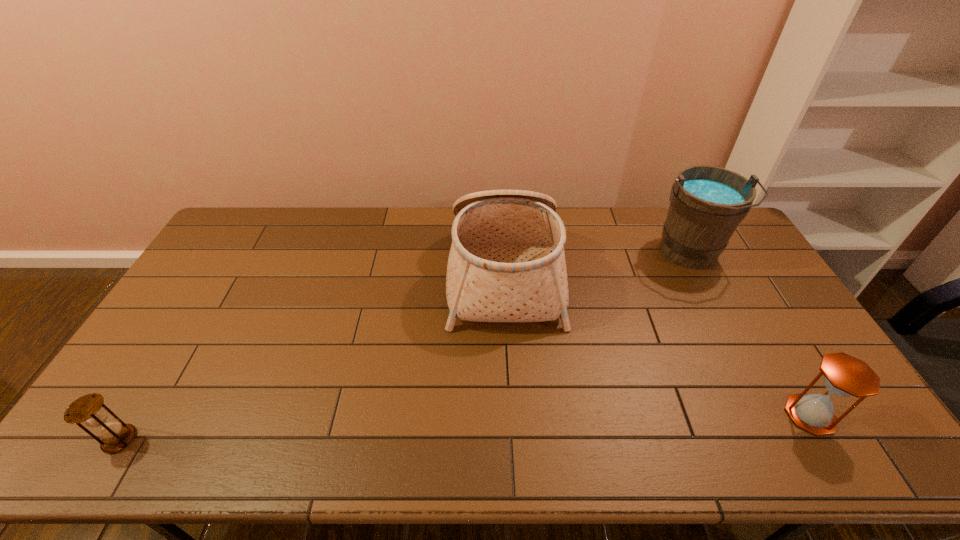
Where is `blank area located on the left of the right hourglass`? This screenshot has width=960, height=540. blank area located on the left of the right hourglass is located at coordinates (692, 415).

Where is `vacant point located on the right of the shortest object`? This screenshot has height=540, width=960. vacant point located on the right of the shortest object is located at coordinates (160, 439).

In order to click on wine bucket situated at the far edge in this screenshot , I will do `click(707, 203)`.

Where is `basket positioned at the far edge`? Image resolution: width=960 pixels, height=540 pixels. basket positioned at the far edge is located at coordinates (507, 263).

I want to click on object located at the left edge, so click(90, 409).

Locate an element on the screen. wine bucket positioned at the right edge is located at coordinates (707, 203).

Image resolution: width=960 pixels, height=540 pixels. I want to click on hourglass located at the right edge, so click(844, 375).

The image size is (960, 540). Identify the location of object at the near left corner. (90, 409).

You are a GUI agent. You are given a task and a screenshot of the screen. Output one action in this format:
    pyautogui.click(x=<x>, y=<y>)
    Task: Click on the object present at the far right corner
    
    Given the screenshot: What is the action you would take?
    pyautogui.click(x=707, y=203)

The image size is (960, 540). I want to click on object that is at the near right corner, so click(x=844, y=375).